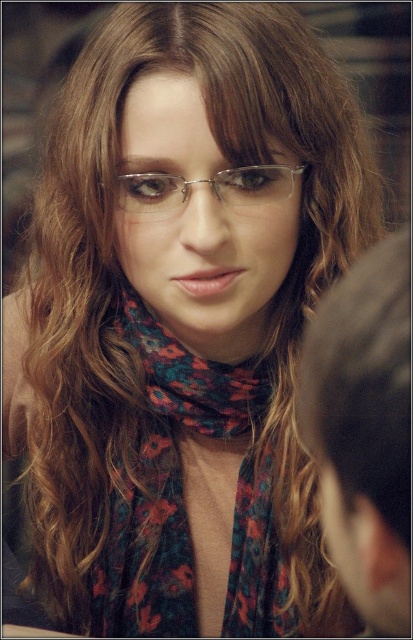
You are a photographer adjusting your camera settings to focus on the person in the image. You notice the point at coordinates (166,481). What object is located at that point?

The point at coordinates (166,481) is where the floral print scarf at center is located.

You are a photographer adjusting your camera settings. You notice the floral print scarf at center and the clear plastic glasses at center in the frame. Which object is wider in the image?

The floral print scarf at center is wider than the clear plastic glasses at center.

You are a photographer adjusting the lighting for a portrait. You notice the brown hair at upper right and the clear plastic glasses at center in your frame. Which object should you focus on first if you want to highlight the taller one?

The brown hair at upper right should be focused on first because it has a greater height compared to the clear plastic glasses at center.